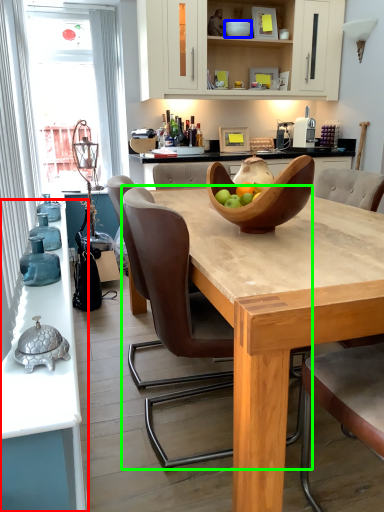
Question: Which is nearer to the countertop (highlighted by a red box)? bowl (highlighted by a blue box) or chair (highlighted by a green box).

Choices:
 (A) bowl
 (B) chair

Answer: (B)